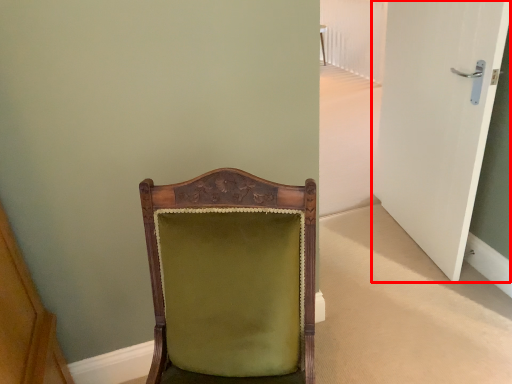
Question: From the image's perspective, what is the correct spatial positioning of door (annotated by the red box) in reference to chair?

Choices:
 (A) below
 (B) above

Answer: (B)